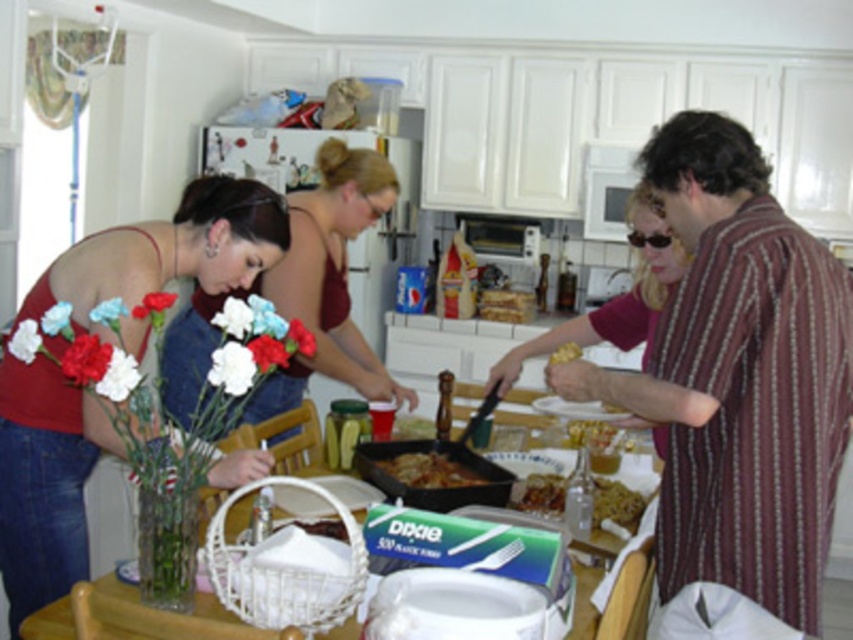
Does point (293, 316) lie behind point (561, 352)?

Yes, point (293, 316) is farther from viewer.

Does denim shirt at center have a greater width compared to golden crispy pastry at right?

Indeed, denim shirt at center has a greater width compared to golden crispy pastry at right.

Does point (201, 337) lie in front of point (564, 349)?

That is False.

I want to click on denim shirt at center, so click(328, 280).

Does brown matte pan at center have a greater width compared to golden crispy pastry at center?

Indeed, brown matte pan at center has a greater width compared to golden crispy pastry at center.

Describe the element at coordinates (430, 468) in the screenshot. I see `brown matte pan at center` at that location.

Who is more forward, (428, 456) or (582, 444)?

Positioned in front is point (428, 456).

The image size is (853, 640). Identify the location of brown matte pan at center. (430, 468).

Who is more distant from viewer, (x=434, y=454) or (x=531, y=496)?

The point (x=434, y=454) is more distant.

Locate an element on the screen. This screenshot has width=853, height=640. brown matte pan at center is located at coordinates (430, 468).